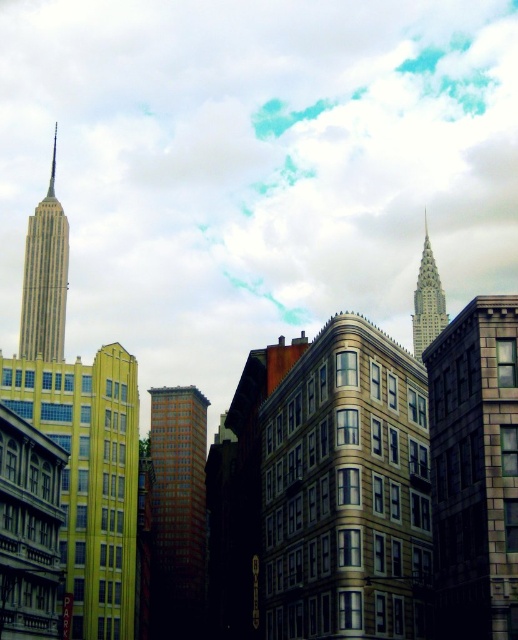
Can you confirm if red brick building at center is thinner than shiny silver spire at upper left?

Correct, red brick building at center's width is less than shiny silver spire at upper left's.

Can you confirm if red brick building at center is positioned below shiny silver spire at upper left?

Indeed, red brick building at center is positioned under shiny silver spire at upper left.

Between point (184, 417) and point (52, 161), which one is positioned behind?

The point (52, 161) is more distant.

Identify the location of red brick building at center. (178, 512).

You are a GUI agent. You are given a task and a screenshot of the screen. Output one action in this format:
    pyautogui.click(x=<x>, y=<y>)
    Task: Click on the beige stone building at center
    The width and height of the screenshot is (518, 640).
    Given the screenshot: What is the action you would take?
    pyautogui.click(x=347, y=490)

Describe the element at coordinates (347, 490) in the screenshot. The width and height of the screenshot is (518, 640). I see `beige stone building at center` at that location.

The image size is (518, 640). What are the coordinates of `beige stone building at center` in the screenshot? It's located at (347, 490).

Consider the image. Does beige stone building at center appear over red brick building at center?

Indeed, beige stone building at center is positioned over red brick building at center.

Which of these two, beige stone building at center or red brick building at center, stands shorter?

beige stone building at center

What do you see at coordinates (347, 490) in the screenshot? I see `beige stone building at center` at bounding box center [347, 490].

At what (x,y) coordinates should I click in order to perform the action: click on beige stone building at center. Please return your answer as a coordinate pair (x, y). Looking at the image, I should click on (347, 490).